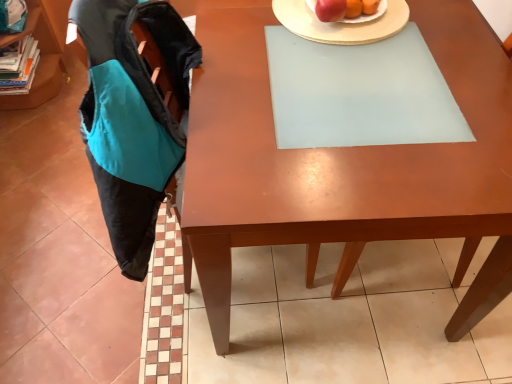
This screenshot has height=384, width=512. Identify the location of vacant region to the left of red matte apple at upper center. (278, 18).